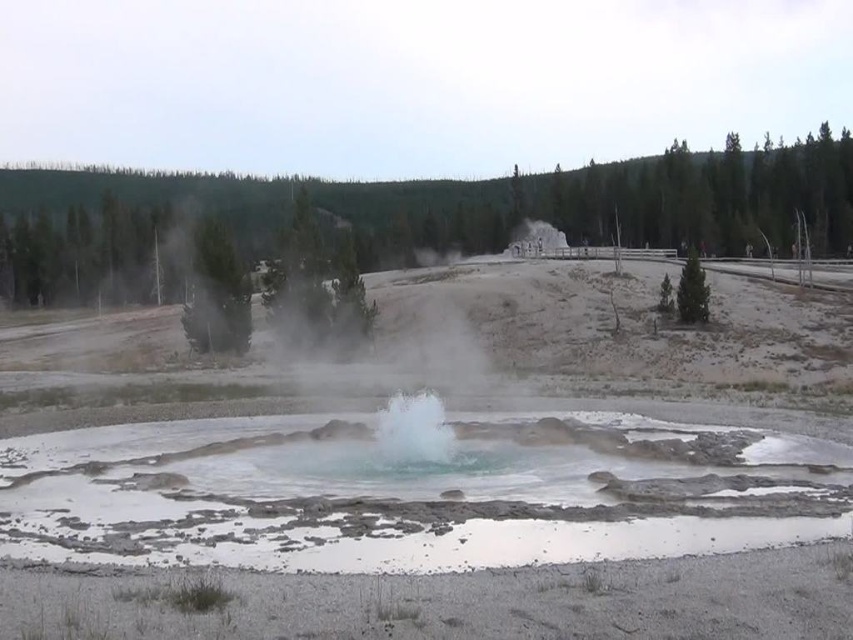
Question: Is translucent blue water at center smaller than white frothy steam at center?

Choices:
 (A) yes
 (B) no

Answer: (B)

Question: Does translucent blue water at center have a lesser width compared to white frothy steam at center?

Choices:
 (A) no
 (B) yes

Answer: (A)

Question: Which point is closer to the camera?

Choices:
 (A) white frothy steam at center
 (B) translucent blue water at center

Answer: (B)

Question: Which object appears farthest from the camera in this image?

Choices:
 (A) white frothy steam at center
 (B) translucent blue water at center

Answer: (A)

Question: Among these points, which one is farthest from the camera?

Choices:
 (A) (602, 445)
 (B) (436, 403)

Answer: (B)

Question: Can you confirm if translucent blue water at center is positioned to the right of white frothy steam at center?

Choices:
 (A) yes
 (B) no

Answer: (B)